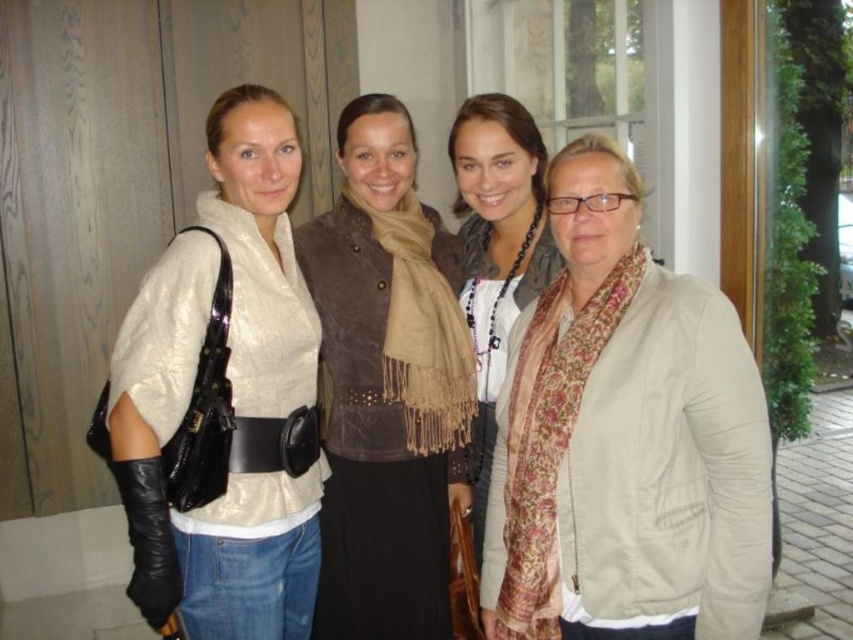
You are taking a photo of the beige fabric jacket at center and the matte white blouse at left. Which one do you need to focus on first to ensure both are in focus?

The beige fabric jacket at center is closer to the viewer than the matte white blouse at left, so you should focus on the beige fabric jacket at center first to ensure both are in focus.

You are a photographer trying to adjust the lighting for a group photo. You notice two items at the center of the image that might cast shadows. Which item is taller between the beige fabric jacket at center and the floral scarf at center?

The floral scarf at center is taller than the beige fabric jacket at center.

Based on the scene description, which object is larger in size between the beige fabric jacket at center and the floral scarf at center?

The beige fabric jacket at center is bigger than the floral scarf at center according to the description.